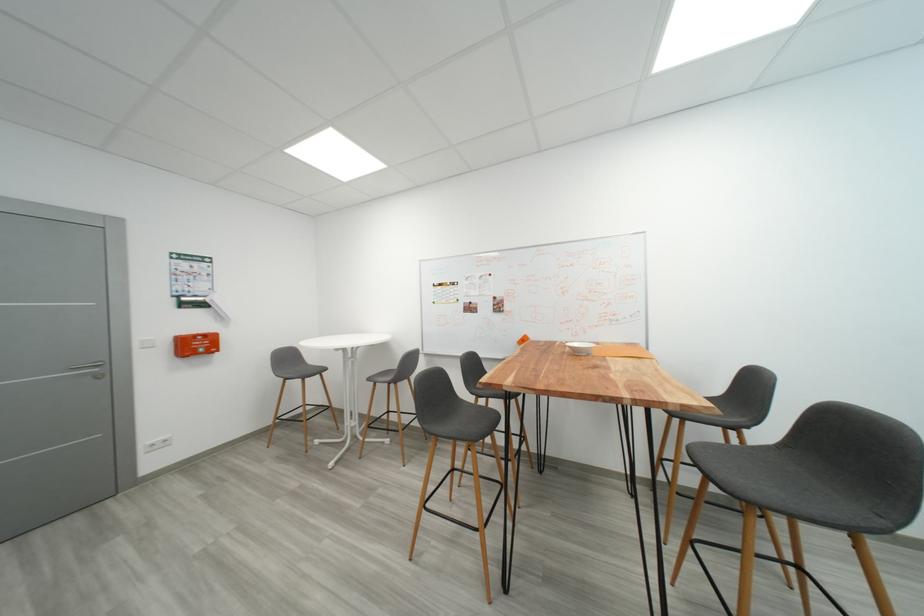
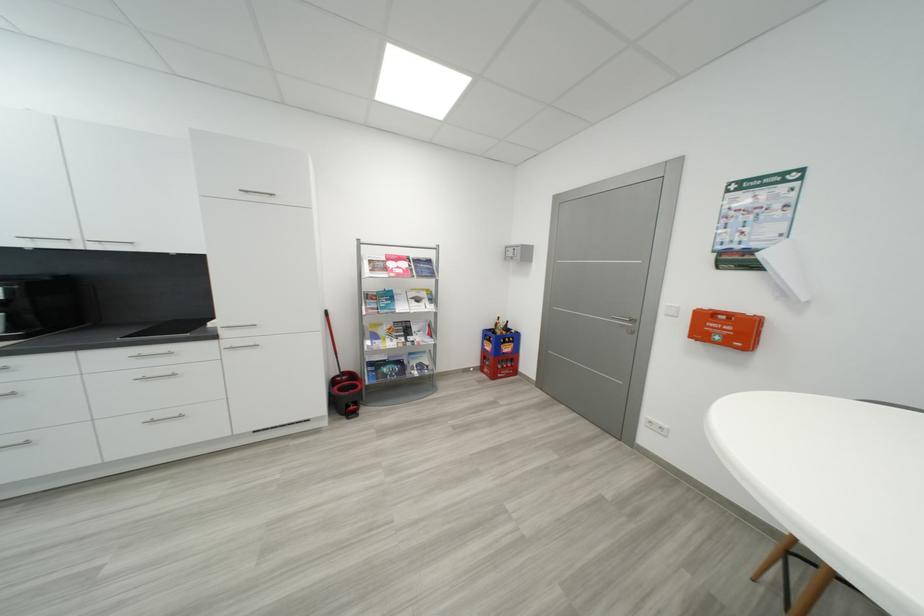
Locate, in the second image, the point that corresponds to pixel 203 347 in the first image.

(733, 333)